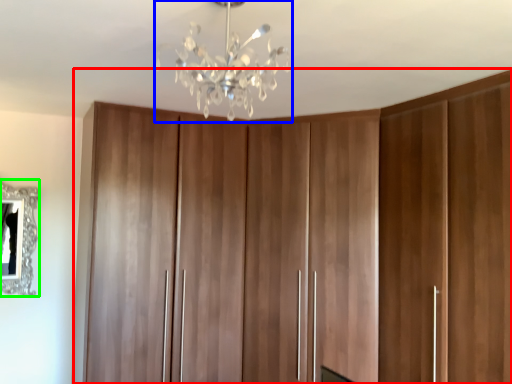
Question: Estimate the real-world distances between objects in this image. Which object is closer to cupboard (highlighted by a red box), lamp (highlighted by a blue box) or mirror (highlighted by a green box)?

Choices:
 (A) lamp
 (B) mirror

Answer: (A)